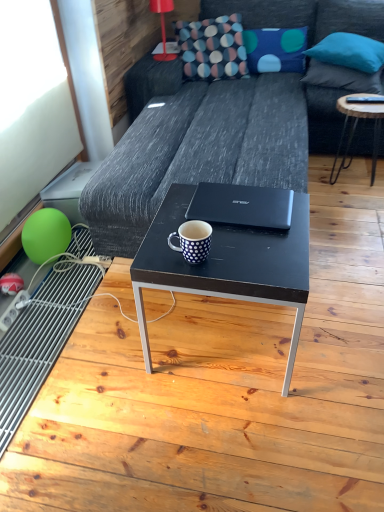
Question: Does white dotted mug at center have a larger size compared to red plastic lamp at upper center?

Choices:
 (A) yes
 (B) no

Answer: (B)

Question: Would you say white dotted mug at center is outside red plastic lamp at upper center?

Choices:
 (A) yes
 (B) no

Answer: (A)

Question: Does white dotted mug at center lie in front of red plastic lamp at upper center?

Choices:
 (A) no
 (B) yes

Answer: (B)

Question: From a real-world perspective, is white dotted mug at center under red plastic lamp at upper center?

Choices:
 (A) no
 (B) yes

Answer: (B)

Question: Does white dotted mug at center appear on the right side of red plastic lamp at upper center?

Choices:
 (A) yes
 (B) no

Answer: (A)

Question: In terms of width, does green rubber balloon at lower left look wider or thinner when compared to black matte coffee table at center?

Choices:
 (A) thin
 (B) wide

Answer: (A)

Question: From their relative heights in the image, would you say green rubber balloon at lower left is taller or shorter than black matte coffee table at center?

Choices:
 (A) short
 (B) tall

Answer: (A)

Question: From a real-world perspective, is green rubber balloon at lower left positioned above or below black matte coffee table at center?

Choices:
 (A) below
 (B) above

Answer: (A)

Question: Relative to black matte coffee table at center, is green rubber balloon at lower left in front or behind?

Choices:
 (A) behind
 (B) front

Answer: (A)

Question: Is wooden round table at right wider or thinner than blue fabric pillow at upper right, the 3th pillow in the left-to-right sequence?

Choices:
 (A) thin
 (B) wide

Answer: (A)

Question: Relative to blue fabric pillow at upper right, the first pillow positioned from the right, is wooden round table at right in front or behind?

Choices:
 (A) front
 (B) behind

Answer: (A)

Question: Do you think wooden round table at right is within blue fabric pillow at upper right, the 3th pillow in the left-to-right sequence, or outside of it?

Choices:
 (A) outside
 (B) inside

Answer: (A)

Question: Considering the positions of point (374, 177) and point (379, 91), is point (374, 177) closer or farther from the camera than point (379, 91)?

Choices:
 (A) farther
 (B) closer

Answer: (A)

Question: From a real-world perspective, is green rubber balloon at lower left positioned above or below dark gray fabric couch at center?

Choices:
 (A) above
 (B) below

Answer: (B)

Question: In terms of size, does green rubber balloon at lower left appear bigger or smaller than dark gray fabric couch at center?

Choices:
 (A) big
 (B) small

Answer: (B)